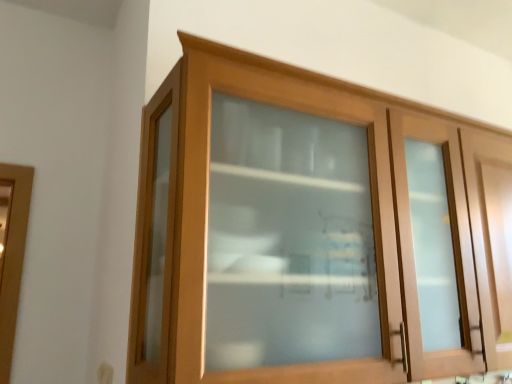
What do you see at coordinates (311, 230) in the screenshot? The height and width of the screenshot is (384, 512). I see `wooden cabinet at center` at bounding box center [311, 230].

Where is `wooden cabinet at center`? wooden cabinet at center is located at coordinates (311, 230).

At what (x,y) coordinates should I click in order to perform the action: click on wooden cabinet at center. Please return your answer as a coordinate pair (x, y). Looking at the image, I should click on (311, 230).